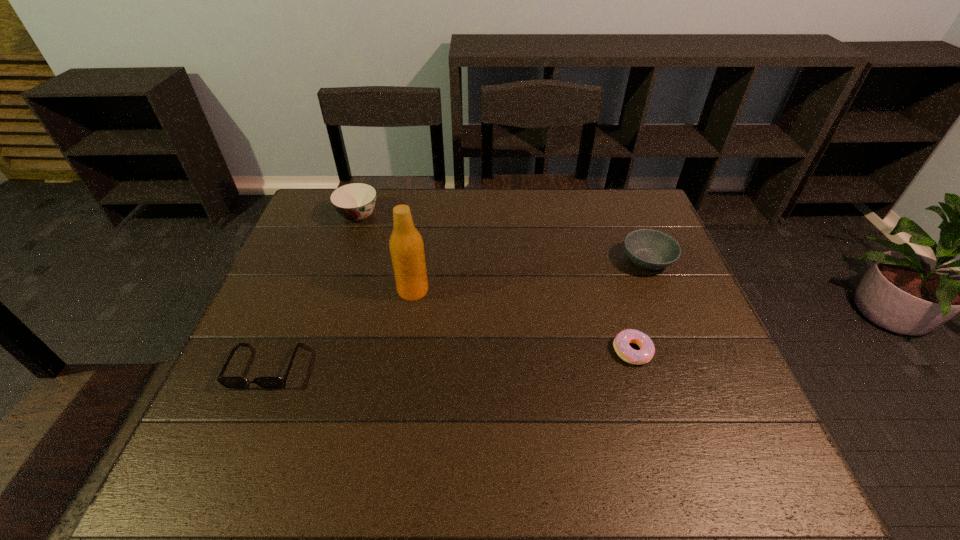
You are a GUI agent. You are given a task and a screenshot of the screen. Output one action in this format:
    pyautogui.click(x=<x>, y=<y>)
    Task: Click on the vacant area that lies between the second farthest object and the shortest object
    
    Given the screenshot: What is the action you would take?
    coord(640,306)

Find the location of a particular element. free space between the shortest object and the left soup bowl is located at coordinates (495, 284).

Locate an element on the screen. This screenshot has height=540, width=960. free spot between the beer bottle and the shorter soup bowl is located at coordinates (530, 275).

Identify the location of blank region between the fourth tallest object and the second farthest object. The width and height of the screenshot is (960, 540). (457, 314).

Find the location of a particular element. The height and width of the screenshot is (540, 960). the third closest object to the beer bottle is located at coordinates (621, 345).

What are the coordinates of `object that ranks as the third closest to the farthest object` in the screenshot? It's located at (648, 249).